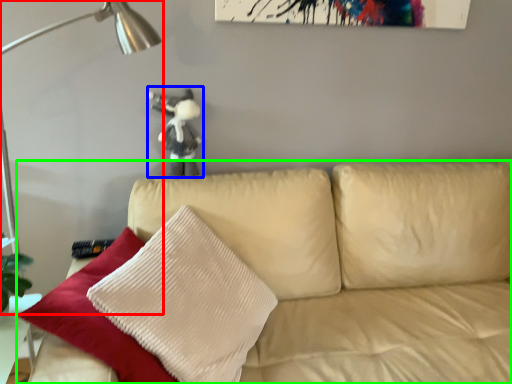
Question: Estimate the real-world distances between objects in this image. Which object is closer to table lamp (highlighted by a red box), figurine (highlighted by a blue box) or studio couch (highlighted by a green box)?

Choices:
 (A) figurine
 (B) studio couch

Answer: (A)